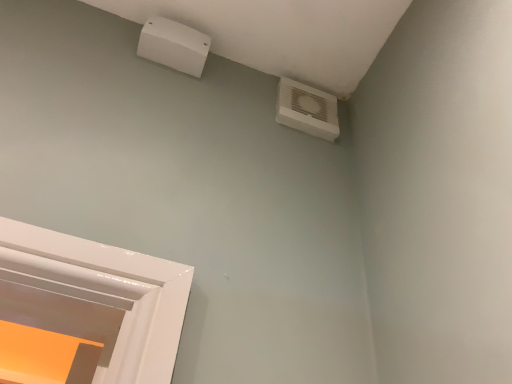
Question: Based on their sizes in the image, would you say white plastic air conditioning unit at upper right is bigger or smaller than white plastic outlet at upper center?

Choices:
 (A) small
 (B) big

Answer: (A)

Question: Relative to white plastic outlet at upper center, is white plastic air conditioning unit at upper right in front or behind?

Choices:
 (A) front
 (B) behind

Answer: (B)

Question: Is white plastic air conditioning unit at upper right taller or shorter than white plastic outlet at upper center?

Choices:
 (A) tall
 (B) short

Answer: (A)

Question: Based on their sizes in the image, would you say white plastic outlet at upper center is bigger or smaller than white plastic air conditioning unit at upper right?

Choices:
 (A) small
 (B) big

Answer: (B)

Question: From the image's perspective, is white plastic outlet at upper center positioned above or below white plastic air conditioning unit at upper right?

Choices:
 (A) above
 (B) below

Answer: (A)

Question: In terms of height, does white plastic outlet at upper center look taller or shorter compared to white plastic air conditioning unit at upper right?

Choices:
 (A) short
 (B) tall

Answer: (A)

Question: Relative to white plastic air conditioning unit at upper right, is white plastic outlet at upper center in front or behind?

Choices:
 (A) behind
 (B) front

Answer: (B)